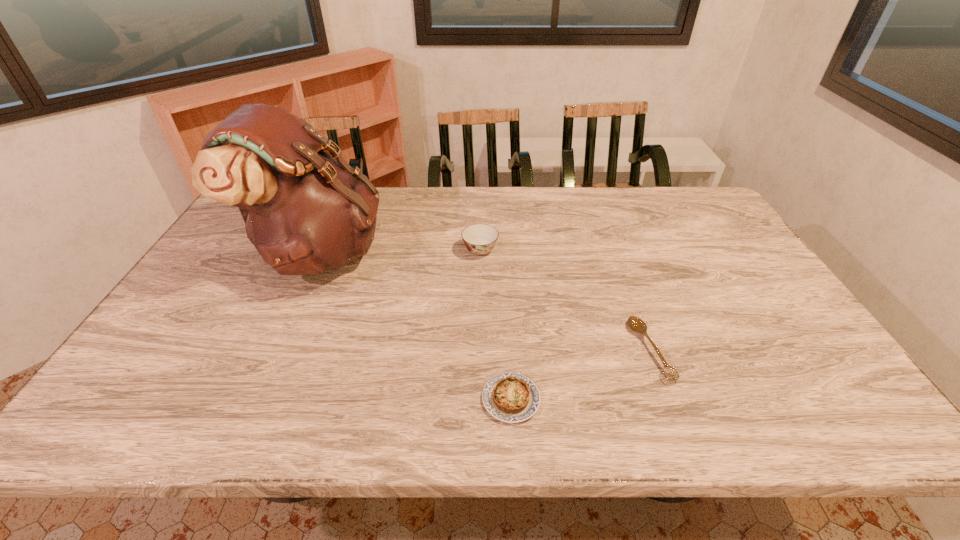
Locate an element on the screen. This screenshot has width=960, height=540. vacant space that satisfies the following two spatial constraints: 1. at the front of the tallest object with buckles; 2. on the right side of the ladle is located at coordinates (276, 350).

At what (x,y) coordinates should I click in order to perform the action: click on free space that satisfies the following two spatial constraints: 1. on the front side of the rightmost object; 2. on the right side of the second tallest object. Please return your answer as a coordinate pair (x, y). The image size is (960, 540). Looking at the image, I should click on (480, 350).

Locate an element on the screen. This screenshot has height=540, width=960. free space that satisfies the following two spatial constraints: 1. at the front of the quiche with buckles; 2. on the left side of the leftmost object is located at coordinates (254, 399).